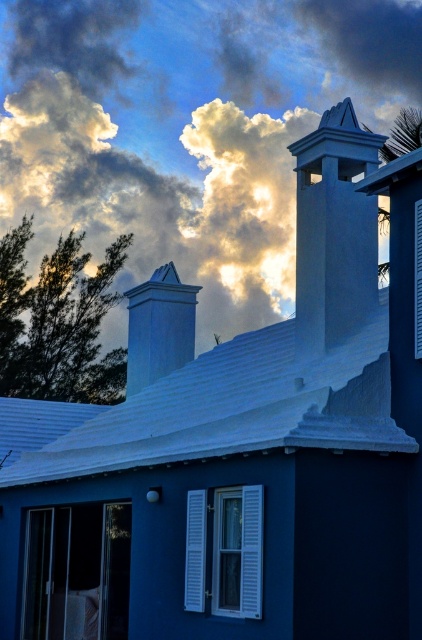
You are an architect analyzing the building facade. You notice two chimneys on the roof. Which of the two chimneys, the smooth white chimney at upper right or the white smooth chimney at upper center, has a smaller width?

The smooth white chimney at upper right has a smaller width than the white smooth chimney at upper center.

In the scene shown: You are an architect analyzing the building facade. You notice the cloudy sky at upper center and the smooth white chimney at upper right. Which object is positioned to the left of the other?

The cloudy sky at upper center is to the left of the smooth white chimney at upper right, meaning the cloudy sky at upper center is positioned to the left of the smooth white chimney at upper right.

You are an architect designing a new building and want to ensure the white smooth chimney at upper center is visible against the cloudy sky at upper center. Based on the scene, will the chimney be easily noticeable?

The cloudy sky at upper center is much taller than the white smooth chimney at upper center, so the chimney may not be easily noticeable as it is shorter and possibly obscured by the taller sky area.